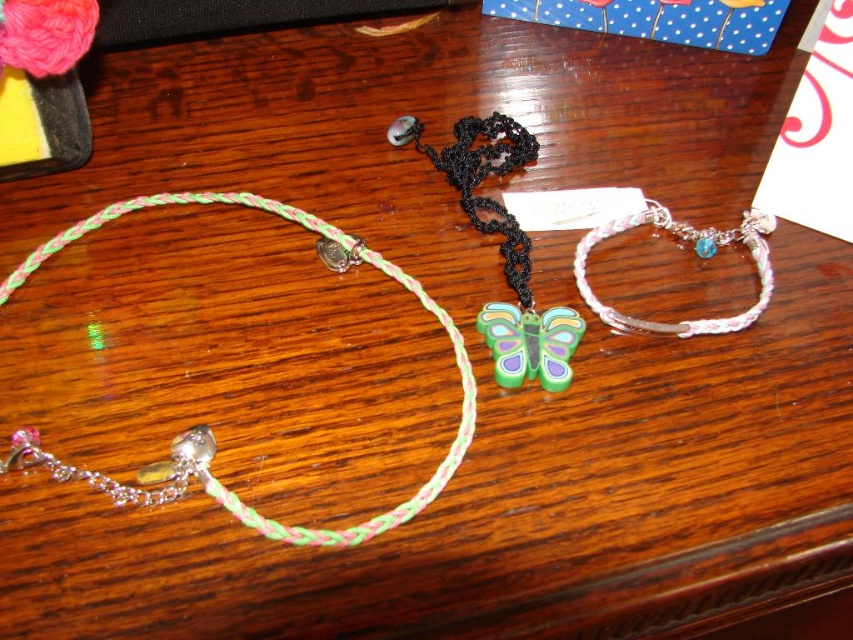
Question: Which point is closer to the camera taking this photo?

Choices:
 (A) (207, 436)
 (B) (758, 273)

Answer: (A)

Question: Which of the following is the farthest from the observer?

Choices:
 (A) multicolored braided necklace at left
 (B) white braided bracelet at center

Answer: (B)

Question: Does multicolored braided necklace at left have a smaller size compared to white braided bracelet at center?

Choices:
 (A) no
 (B) yes

Answer: (A)

Question: Considering the relative positions of multicolored braided necklace at left and white braided bracelet at center in the image provided, where is multicolored braided necklace at left located with respect to white braided bracelet at center?

Choices:
 (A) left
 (B) right

Answer: (A)

Question: Is multicolored braided necklace at left smaller than white braided bracelet at center?

Choices:
 (A) no
 (B) yes

Answer: (A)